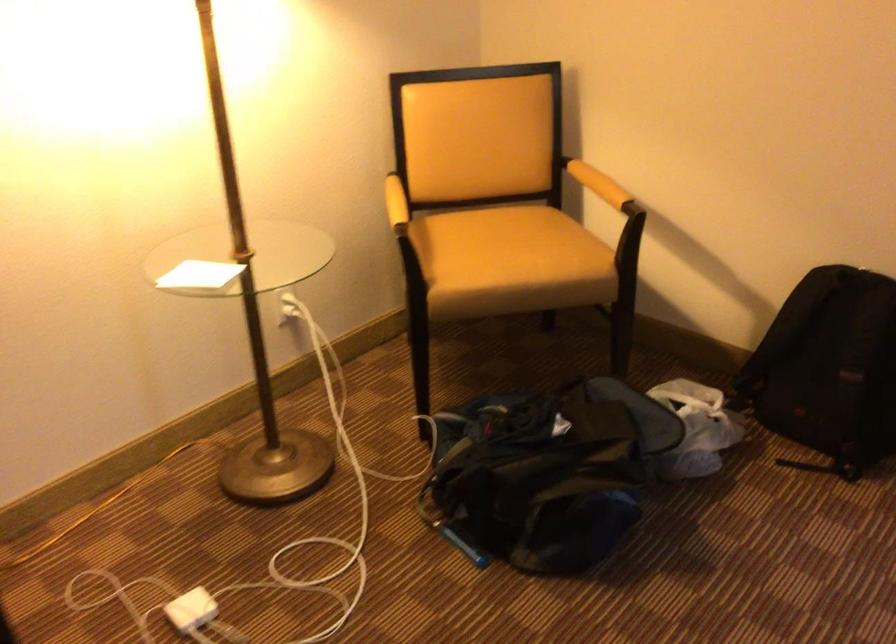
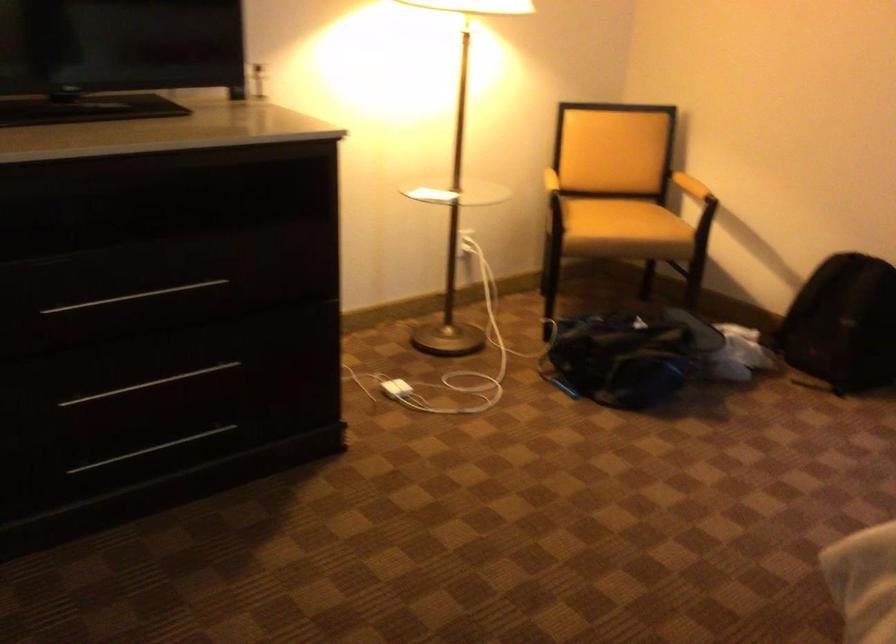
Where in the second image is the point corresponding to (x=395, y=203) from the first image?

(543, 174)